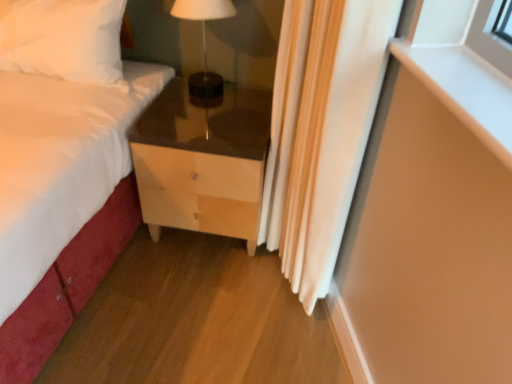
Question: Is the position of matte brown table lamp at center more distant than that of matte wood chest of drawers at lower center?

Choices:
 (A) no
 (B) yes

Answer: (B)

Question: Is matte brown table lamp at center smaller than matte wood chest of drawers at lower center?

Choices:
 (A) yes
 (B) no

Answer: (A)

Question: Considering the relative sizes of matte brown table lamp at center and matte wood chest of drawers at lower center in the image provided, is matte brown table lamp at center bigger than matte wood chest of drawers at lower center?

Choices:
 (A) no
 (B) yes

Answer: (A)

Question: Considering the relative positions of matte brown table lamp at center and matte wood chest of drawers at lower center in the image provided, is matte brown table lamp at center in front of matte wood chest of drawers at lower center?

Choices:
 (A) yes
 (B) no

Answer: (B)

Question: Considering the relative sizes of matte brown table lamp at center and matte wood chest of drawers at lower center in the image provided, is matte brown table lamp at center wider than matte wood chest of drawers at lower center?

Choices:
 (A) no
 (B) yes

Answer: (A)

Question: In the image, is matte wood chest of drawers at lower center on the left side or the right side of white fabric curtain at right?

Choices:
 (A) right
 (B) left

Answer: (B)

Question: Considering the positions of matte wood chest of drawers at lower center and white fabric curtain at right in the image, is matte wood chest of drawers at lower center bigger or smaller than white fabric curtain at right?

Choices:
 (A) big
 (B) small

Answer: (A)

Question: Considering the positions of point (183, 168) and point (324, 190), is point (183, 168) closer or farther from the camera than point (324, 190)?

Choices:
 (A) farther
 (B) closer

Answer: (A)

Question: Looking at their shapes, would you say matte wood chest of drawers at lower center is wider or thinner than white fabric curtain at right?

Choices:
 (A) wide
 (B) thin

Answer: (A)

Question: From a real-world perspective, is white fabric curtain at right above or below matte brown table lamp at center?

Choices:
 (A) below
 (B) above

Answer: (A)

Question: Is white fabric curtain at right to the left or to the right of matte brown table lamp at center in the image?

Choices:
 (A) right
 (B) left

Answer: (A)

Question: In terms of size, does white fabric curtain at right appear bigger or smaller than matte brown table lamp at center?

Choices:
 (A) big
 (B) small

Answer: (A)

Question: Considering the positions of white fabric curtain at right and matte brown table lamp at center in the image, is white fabric curtain at right taller or shorter than matte brown table lamp at center?

Choices:
 (A) tall
 (B) short

Answer: (A)

Question: From a real-world perspective, is matte wood chest of drawers at lower center above or below matte brown table lamp at center?

Choices:
 (A) above
 (B) below

Answer: (B)

Question: Does point (237, 213) appear closer or farther from the camera than point (206, 79)?

Choices:
 (A) farther
 (B) closer

Answer: (B)